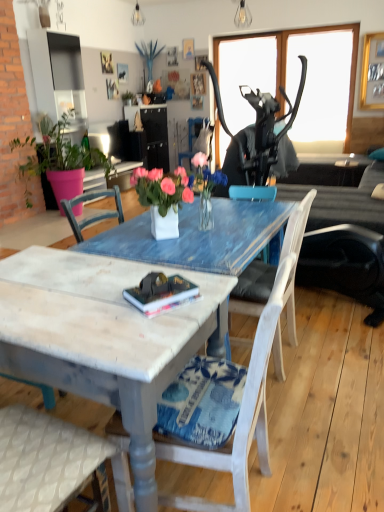
The width and height of the screenshot is (384, 512). What are the coordinates of `free spot in front of hardcover book at center` in the screenshot? It's located at (168, 326).